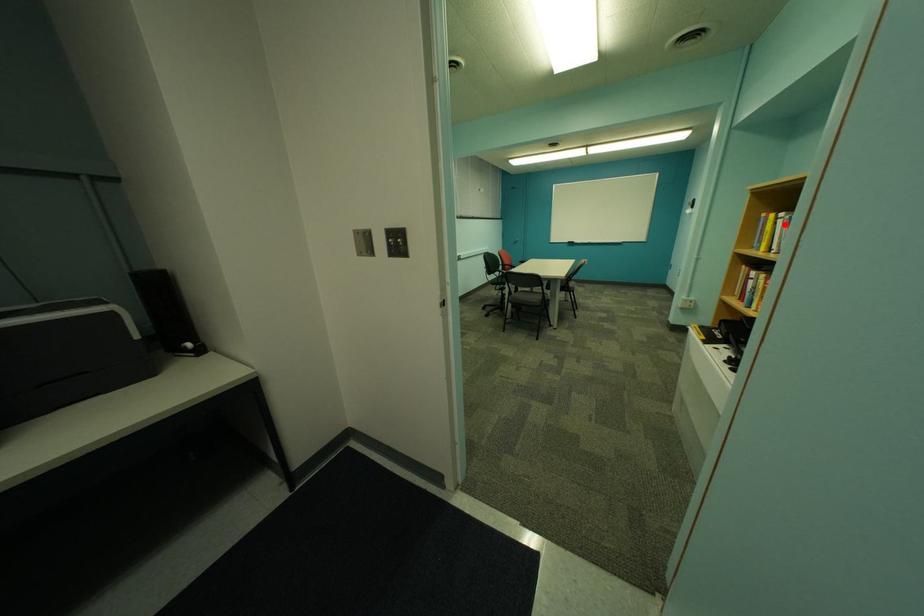
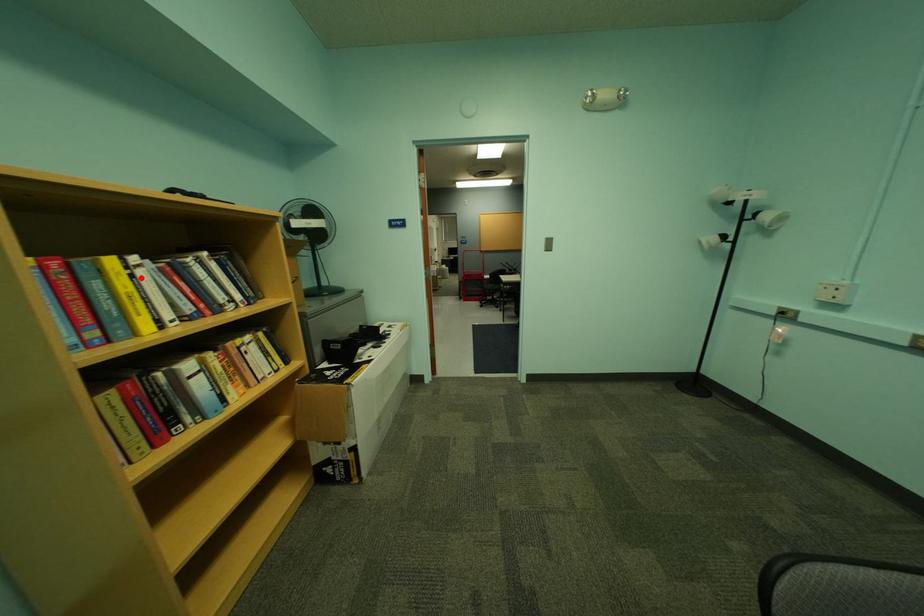
I am providing you with two images of the same scene from different viewpoints. A red point is marked on the first image and another point is marked on the second image. Is the red point in image1 aligned with the point shown in image2?

Yes